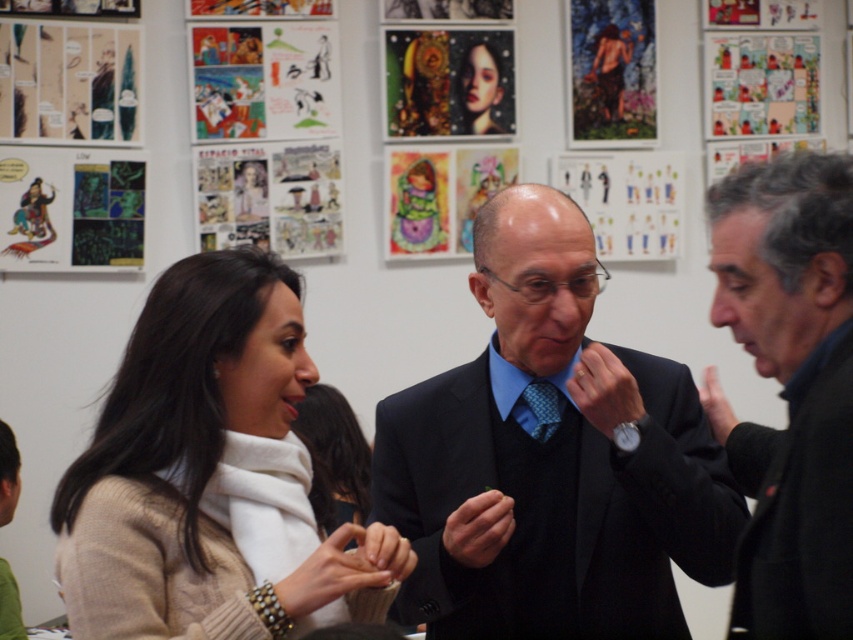
Question: Which object is closer to the camera taking this photo?

Choices:
 (A) black wool jacket at right
 (B) matte black suit at center
 (C) beige sweater at left

Answer: (A)

Question: Which point is farther from the camera taking this photo?

Choices:
 (A) (555, 486)
 (B) (718, 440)
 (C) (140, 596)

Answer: (B)

Question: Is matte black suit at center to the left of black wool jacket at right from the viewer's perspective?

Choices:
 (A) no
 (B) yes

Answer: (B)

Question: Does matte black suit at center have a larger size compared to black wool jacket at right?

Choices:
 (A) no
 (B) yes

Answer: (B)

Question: Among these objects, which one is nearest to the camera?

Choices:
 (A) black wool jacket at right
 (B) beige sweater at left

Answer: (A)

Question: Is matte black suit at center to the right of beige sweater at left from the viewer's perspective?

Choices:
 (A) yes
 (B) no

Answer: (A)